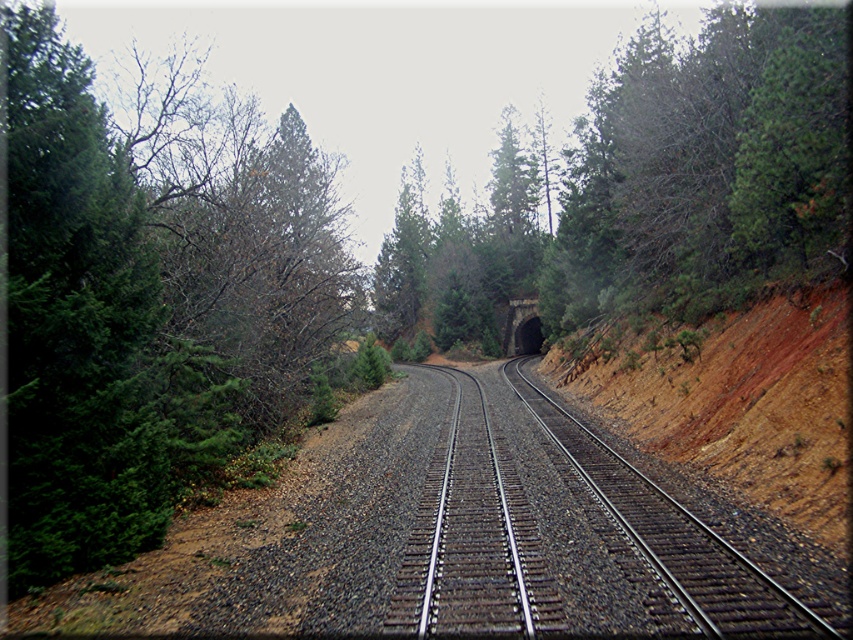
Consider the image. Who is more forward, (440, 554) or (831, 394)?

Point (440, 554) is more forward.

Who is higher up, metal/smooth train tracks at center or dull reddish-brown dirt at center-right?

Positioned higher is dull reddish-brown dirt at center-right.

Between point (459, 426) and point (750, 484), which one is positioned in front?

Point (750, 484) is more forward.

I want to click on metal/smooth train tracks at center, so click(587, 522).

Between green textured tree at center and dull reddish-brown dirt at center-right, which one is positioned higher?

green textured tree at center

Is point (672, 42) more distant than point (842, 381)?

Yes, it is.

Where is `green textured tree at center`? The width and height of the screenshot is (853, 640). green textured tree at center is located at coordinates (648, 188).

Between green textured tree at center and metal/smooth train tracks at center, which one appears on the right side from the viewer's perspective?

From the viewer's perspective, green textured tree at center appears more on the right side.

The height and width of the screenshot is (640, 853). What do you see at coordinates (648, 188) in the screenshot?
I see `green textured tree at center` at bounding box center [648, 188].

I want to click on green textured tree at center, so click(648, 188).